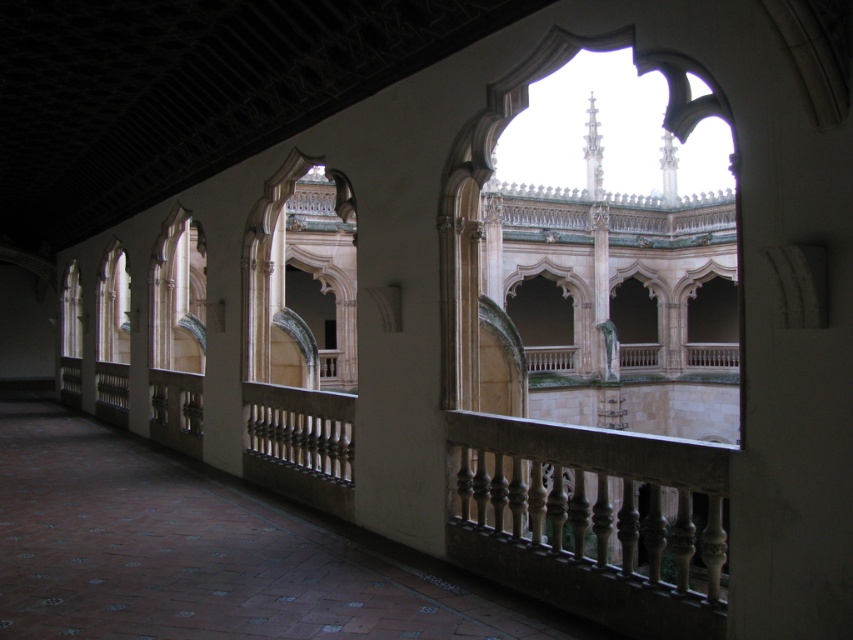
Is matte glass window at center further to camera compared to clear glass window at center?

That is False.

Is matte glass window at center wider than clear glass window at center?

Yes.

Who is more forward, [103,339] or [64,342]?

Point [103,339]

Where is `matte glass window at center`? This screenshot has height=640, width=853. matte glass window at center is located at coordinates click(112, 307).